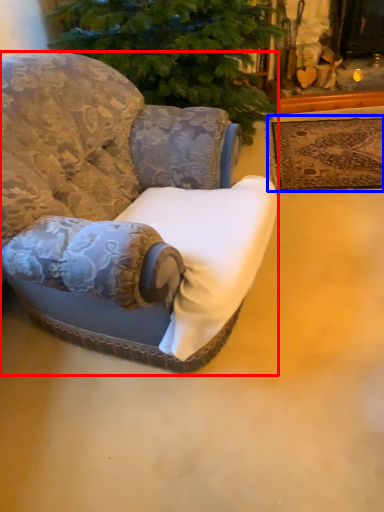
Question: Which object is closer to the camera taking this photo, chair (highlighted by a red box) or mat (highlighted by a blue box)?

Choices:
 (A) chair
 (B) mat

Answer: (A)